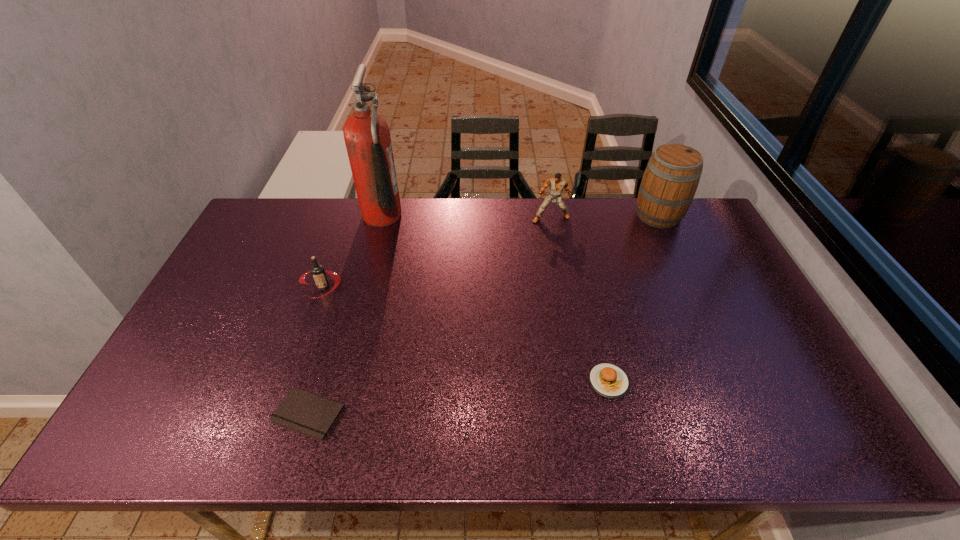
You are a GUI agent. You are given a task and a screenshot of the screen. Output one action in this format:
    pyautogui.click(x=<x>, y=<y>)
    Task: Click on the vacant area that lies between the checkbook and the fifth shortest object
    
    Given the screenshot: What is the action you would take?
    pyautogui.click(x=484, y=314)

In order to click on free spot between the fourth shortest object and the food in this screenshot , I will do `click(580, 300)`.

You are a GUI agent. You are given a task and a screenshot of the screen. Output one action in this format:
    pyautogui.click(x=<x>, y=<y>)
    Task: Click on the free space between the tallest object and the third tallest object
    
    Given the screenshot: What is the action you would take?
    pyautogui.click(x=467, y=217)

Image resolution: width=960 pixels, height=540 pixels. I want to click on empty space that is in between the fire extinguisher and the root beer, so click(x=352, y=251).

Where is `the second closest object to the shortest object`? the second closest object to the shortest object is located at coordinates 609,380.

Identify which object is the third nearest to the third tallest object. Please provide its 2D coordinates. Your answer should be formatted as a tuple, i.e. [(x, y)], where the tuple contains the x and y coordinates of a point satisfying the conditions above.

[(609, 380)]

Find the location of `vacant space that satisfies the following two spatial constraints: 1. on the front-facing side of the puncher; 2. on the left side of the fifth tallest object`. vacant space that satisfies the following two spatial constraints: 1. on the front-facing side of the puncher; 2. on the left side of the fifth tallest object is located at coordinates (x=581, y=382).

Identify the location of vacant space that satisfies the following two spatial constraints: 1. on the back side of the food; 2. on the right side of the cider. pyautogui.click(x=569, y=215).

Image resolution: width=960 pixels, height=540 pixels. I want to click on vacant space that satisfies the following two spatial constraints: 1. on the front of the fire extinguisher near the operation label; 2. on the back side of the fifth tallest object, so click(339, 382).

Image resolution: width=960 pixels, height=540 pixels. Identify the location of vacant position in the image that satisfies the following two spatial constraints: 1. on the front of the tallest object near the operation label; 2. on the left side of the food. (339, 382).